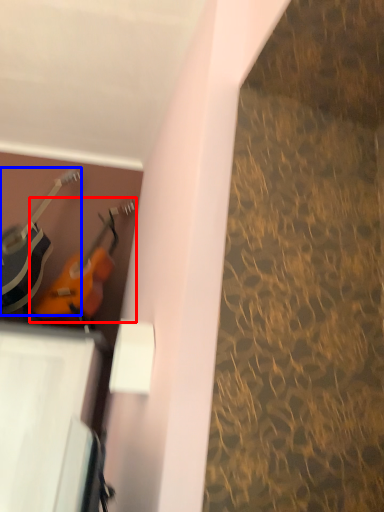
Question: Which point is closer to the camera, guitar (highlighted by a red box) or guitar (highlighted by a blue box)?

Choices:
 (A) guitar
 (B) guitar

Answer: (B)